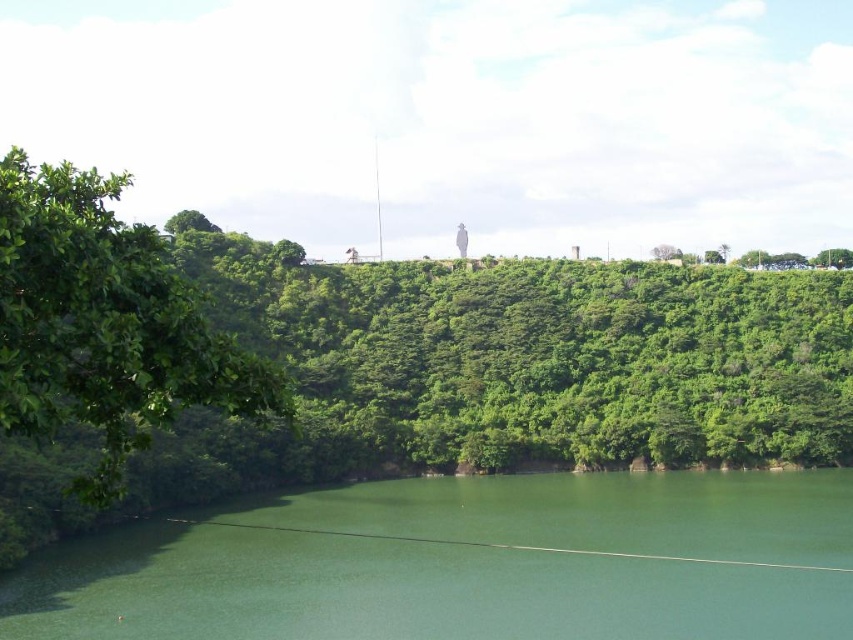
Is green smooth water at center to the right of green leafy tree at left from the viewer's perspective?

Yes, green smooth water at center is to the right of green leafy tree at left.

Is green smooth water at center wider than green leafy tree at left?

Yes.

Between point (227, 612) and point (30, 368), which one is positioned behind?

Positioned behind is point (227, 612).

Image resolution: width=853 pixels, height=640 pixels. What are the coordinates of `green smooth water at center` in the screenshot? It's located at (468, 563).